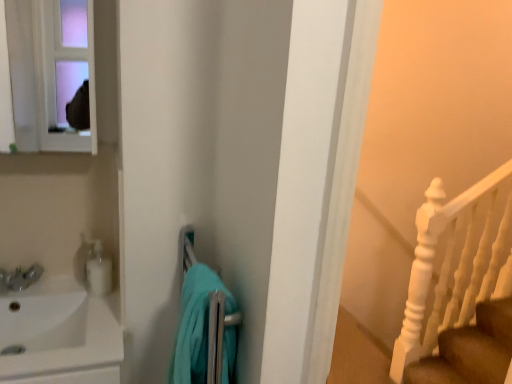
Question: Is white glossy soap dispenser at left taller than matte white medicine cabinet at upper left?

Choices:
 (A) yes
 (B) no

Answer: (B)

Question: Is white glossy soap dispenser at left at the left side of matte white medicine cabinet at upper left?

Choices:
 (A) no
 (B) yes

Answer: (A)

Question: Is white glossy soap dispenser at left surrounding matte white medicine cabinet at upper left?

Choices:
 (A) no
 (B) yes

Answer: (A)

Question: Is white glossy soap dispenser at left to the right of matte white medicine cabinet at upper left from the viewer's perspective?

Choices:
 (A) no
 (B) yes

Answer: (B)

Question: Is white glossy soap dispenser at left outside of matte white medicine cabinet at upper left?

Choices:
 (A) yes
 (B) no

Answer: (A)

Question: Is white glossy soap dispenser at left positioned in front of matte white medicine cabinet at upper left?

Choices:
 (A) no
 (B) yes

Answer: (A)

Question: Can you confirm if white glossy sink at left is bigger than matte white medicine cabinet at upper left?

Choices:
 (A) yes
 (B) no

Answer: (A)

Question: Would you say white glossy sink at left is a long distance from matte white medicine cabinet at upper left?

Choices:
 (A) yes
 (B) no

Answer: (A)

Question: From the image's perspective, is white glossy sink at left located above matte white medicine cabinet at upper left?

Choices:
 (A) yes
 (B) no

Answer: (B)

Question: Considering the relative sizes of white glossy sink at left and matte white medicine cabinet at upper left in the image provided, is white glossy sink at left shorter than matte white medicine cabinet at upper left?

Choices:
 (A) yes
 (B) no

Answer: (B)

Question: From a real-world perspective, is white glossy sink at left located higher than matte white medicine cabinet at upper left?

Choices:
 (A) yes
 (B) no

Answer: (B)

Question: Does white glossy sink at left have a lesser width compared to matte white medicine cabinet at upper left?

Choices:
 (A) no
 (B) yes

Answer: (A)

Question: From the image's perspective, is teal fabric towel at center located above matte white medicine cabinet at upper left?

Choices:
 (A) no
 (B) yes

Answer: (A)